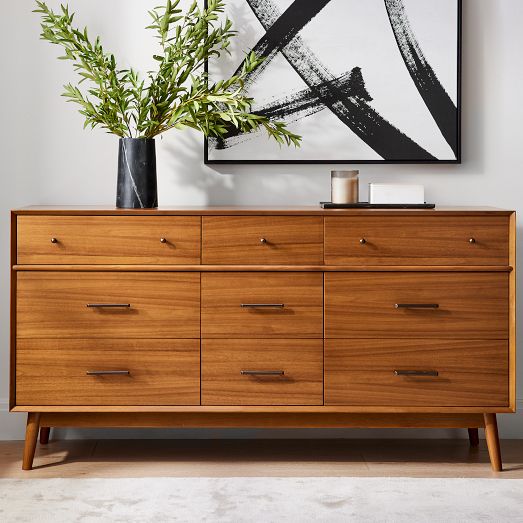
The width and height of the screenshot is (523, 523). I want to click on drawer with single knob, so click(x=277, y=244).